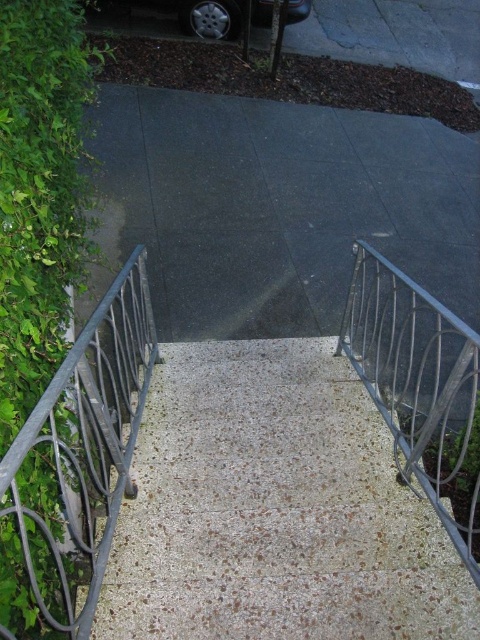
Question: Does green leafy hedge at left appear on the right side of dark gray wrought iron at left?

Choices:
 (A) no
 (B) yes

Answer: (A)

Question: Can you confirm if green leafy hedge at left is thinner than silver metallic car at upper center?

Choices:
 (A) no
 (B) yes

Answer: (B)

Question: Which object appears farthest from the camera in this image?

Choices:
 (A) speckled concrete stairs at center
 (B) green leafy hedge at left
 (C) silver metallic car at upper center

Answer: (C)

Question: Can you confirm if speckled concrete stairs at center is positioned to the left of dark gray wrought iron at left?

Choices:
 (A) yes
 (B) no

Answer: (B)

Question: Estimate the real-world distances between objects in this image. Which object is farther from the silver metallic car at upper center?

Choices:
 (A) green leafy hedge at left
 (B) dark gray wrought iron at left

Answer: (B)

Question: Which point appears farthest from the camera in this image?

Choices:
 (A) (120, 422)
 (B) (233, 20)
 (C) (72, 17)

Answer: (B)